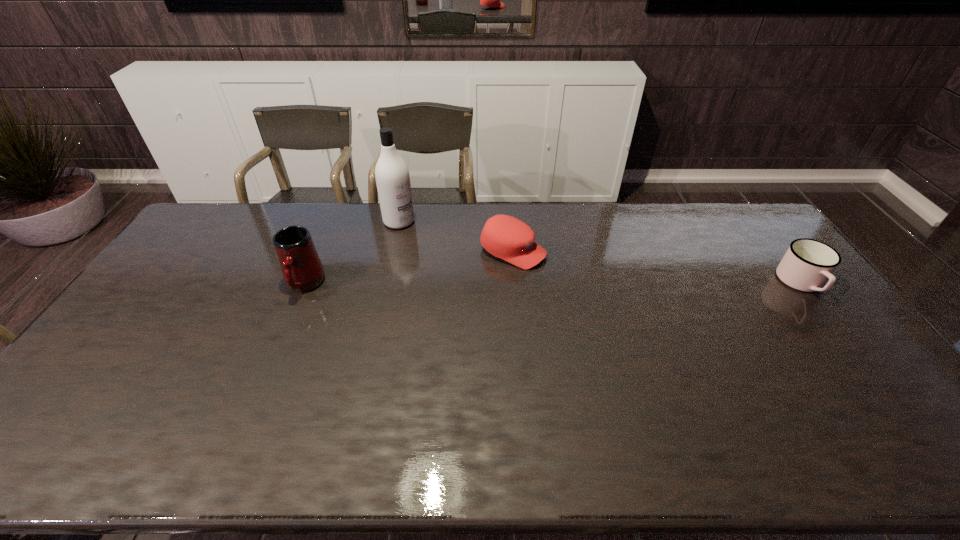
Where is `the taller mug`? The width and height of the screenshot is (960, 540). the taller mug is located at coordinates (302, 269).

Identify the location of the leftmost object. (x=302, y=269).

This screenshot has height=540, width=960. I want to click on the rightmost object, so click(x=806, y=266).

Where is `the shorter mug`? the shorter mug is located at coordinates (806, 266).

Locate an element on the screen. the third object from left to right is located at coordinates (508, 238).

What are the coordinates of `the second object from left to right` in the screenshot? It's located at (392, 176).

The height and width of the screenshot is (540, 960). Find the location of `the farthest object`. the farthest object is located at coordinates (392, 176).

Find the location of a particular element. vacant space situated on the side of the taller mug with the handle is located at coordinates (283, 336).

Locate an element on the screen. blank space located 0.150m on the side of the right mug with the handle is located at coordinates (848, 343).

Locate an element on the screen. vacant space located 0.120m on the front-facing side of the cap is located at coordinates (576, 274).